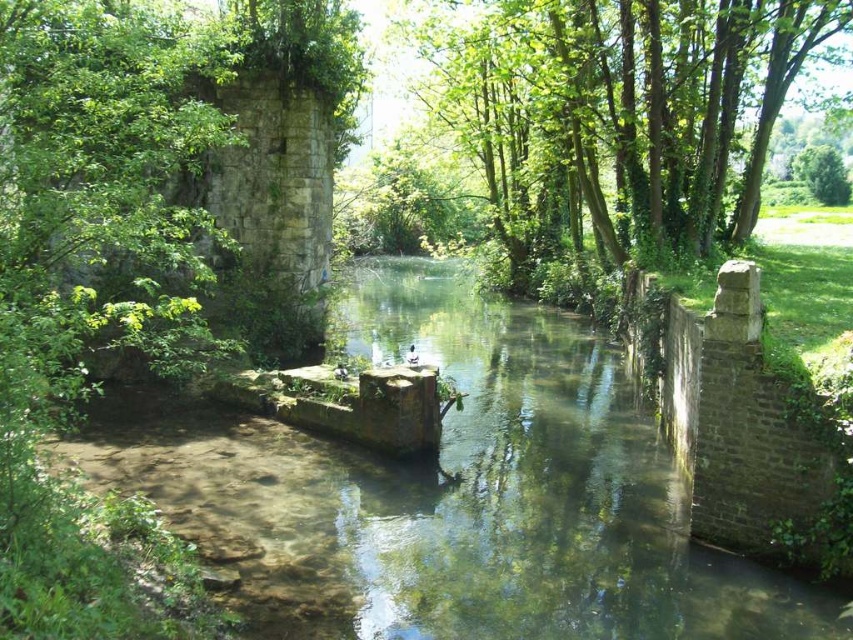
Does clear stone river at center appear over green leafy tree at upper center?

Incorrect, clear stone river at center is not positioned above green leafy tree at upper center.

Which is in front, point (711, 618) or point (503, 22)?

Point (711, 618) is in front.

Between point (619, 492) and point (698, 147), which one is positioned in front?

Point (619, 492) is more forward.

The height and width of the screenshot is (640, 853). I want to click on clear stone river at center, so click(451, 493).